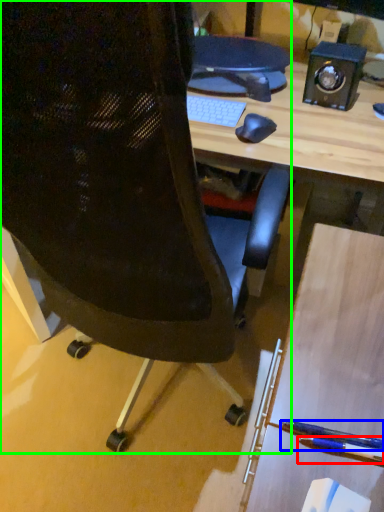
Question: Which object is positioned closest to pencil (highlighted by a red box)? Select from penguin (highlighted by a blue box) and chair (highlighted by a green box).

Choices:
 (A) penguin
 (B) chair

Answer: (A)